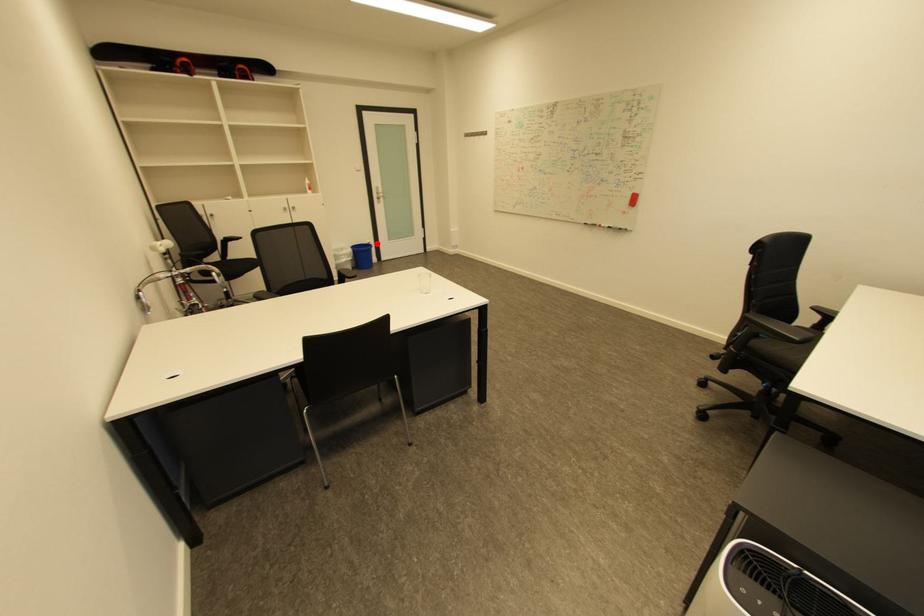
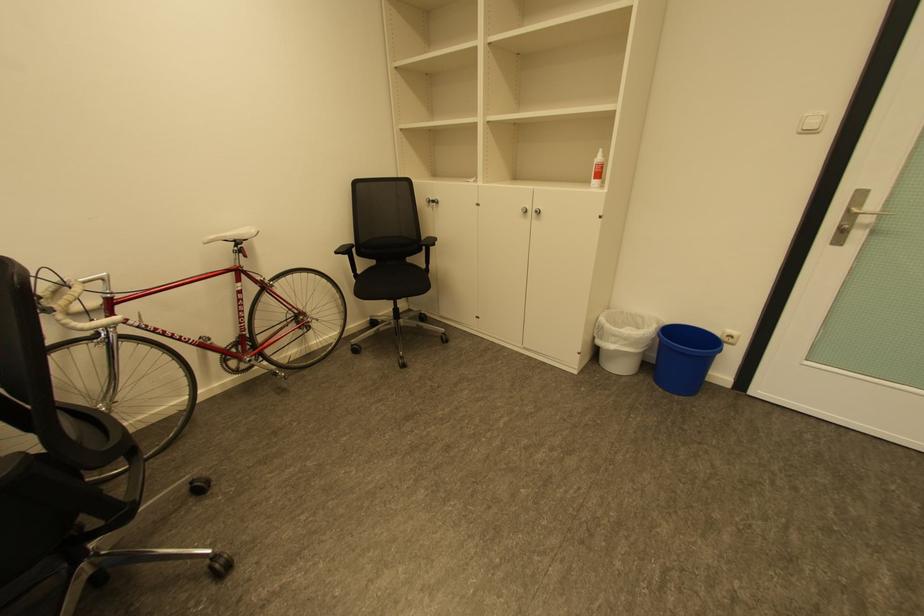
The point at the highlighted location is marked in the first image. Where is the corresponding point in the second image?

(737, 337)